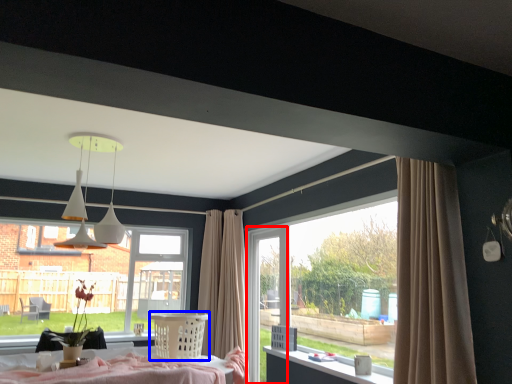
Question: Among these objects, which one is farthest to the camera, screen door (highlighted by a red box) or furniture (highlighted by a blue box)?

Choices:
 (A) screen door
 (B) furniture

Answer: (A)